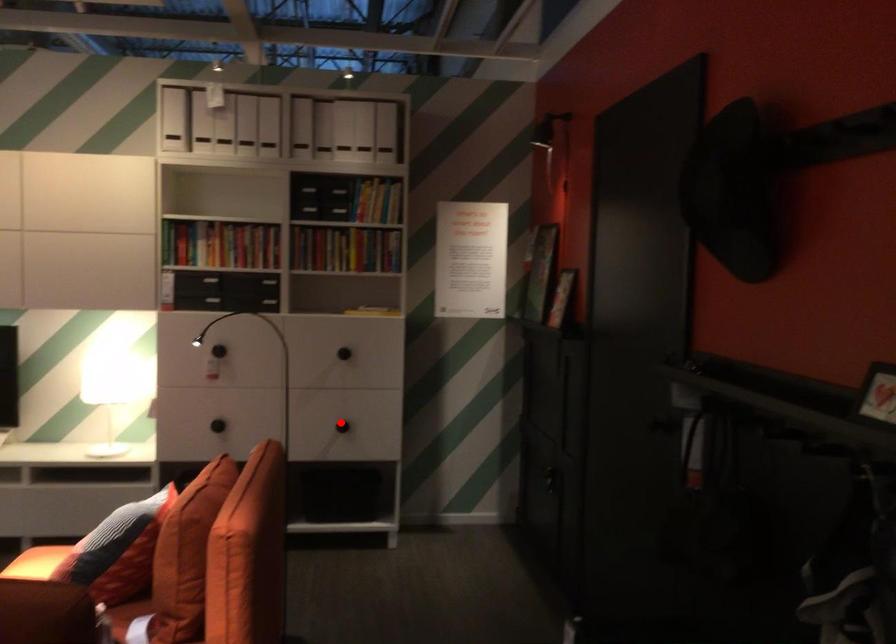
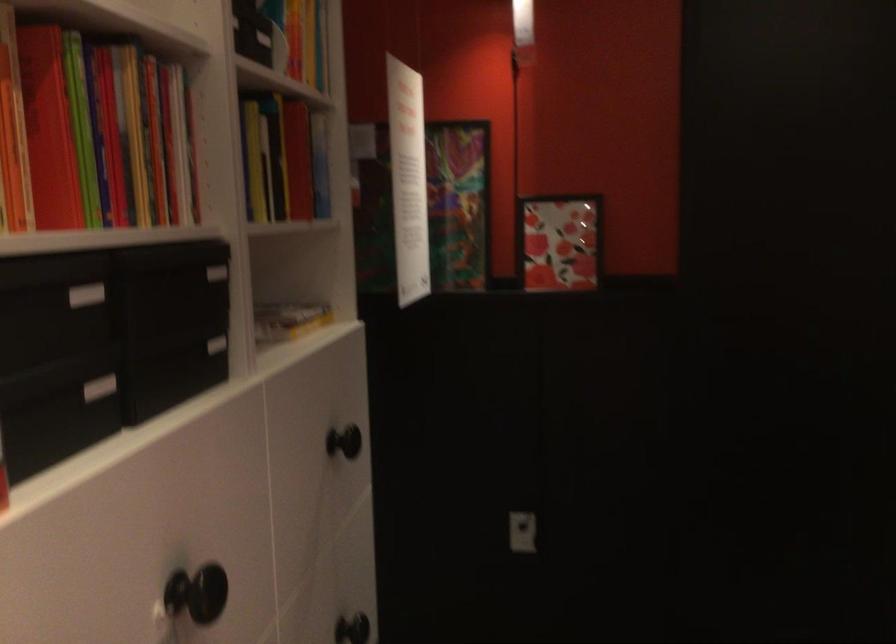
Question: I am providing you with two images of the same scene from different viewpoints. In image1, a red point is highlighted. Considering the same 3D point in image2, which of the following is correct?

Choices:
 (A) It is closer
 (B) It is farther

Answer: (A)